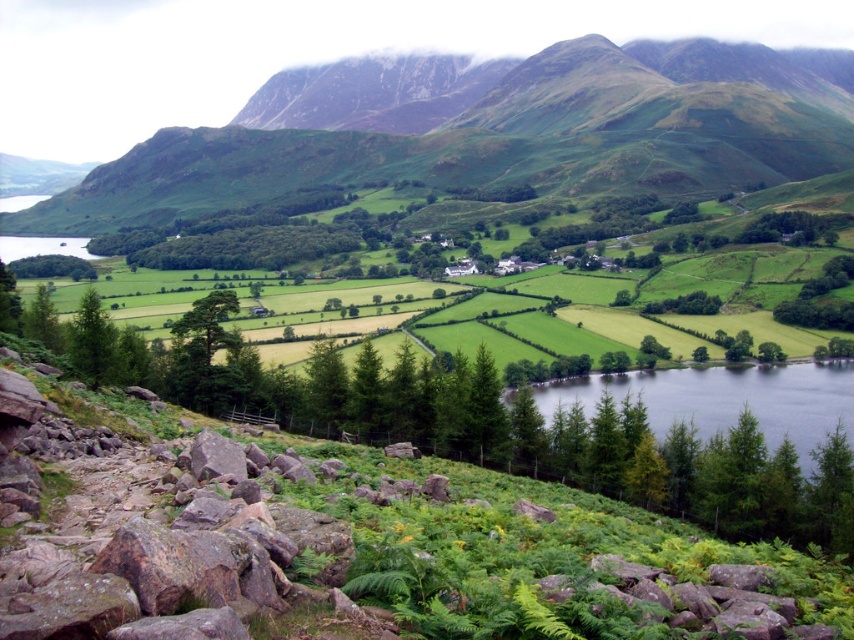
Based on the photo, is green grassy water at lower center thinner than green leafy tree at lower left?

No.

Based on the photo, is green grassy water at lower center positioned in front of green leafy tree at lower left?

Yes.

Measure the distance between point (x=636, y=371) and camera.

Point (x=636, y=371) and camera are 181.17 meters apart from each other.

I want to click on green grassy water at lower center, so click(723, 400).

Which is in front, point (606, 84) or point (21, 260)?

Point (21, 260) is in front.

Which is in front, point (647, 52) or point (56, 269)?

Point (56, 269) is more forward.

Find the location of a particular element. The height and width of the screenshot is (640, 854). green grassy mountain at upper center is located at coordinates (502, 138).

What do you see at coordinates (502, 138) in the screenshot? Image resolution: width=854 pixels, height=640 pixels. I see `green grassy mountain at upper center` at bounding box center [502, 138].

Which is more to the right, green grassy mountain at upper center or green grassy water at lower center?

Positioned to the right is green grassy water at lower center.

You are a GUI agent. You are given a task and a screenshot of the screen. Output one action in this format:
    pyautogui.click(x=<x>, y=<y>)
    Task: Click on the green grassy mountain at upper center
    This screenshot has width=854, height=640.
    Given the screenshot: What is the action you would take?
    pyautogui.click(x=502, y=138)